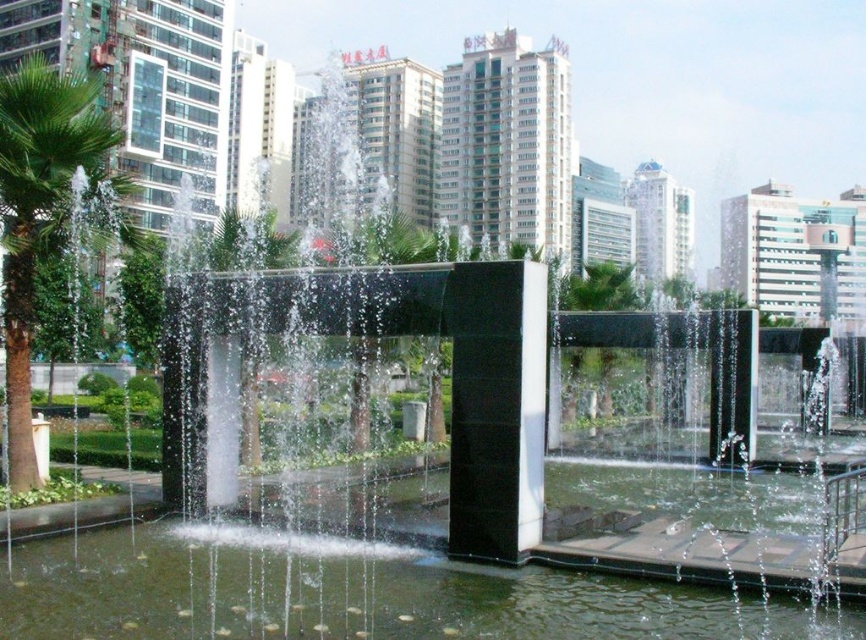
Who is lower down, clear water at center or green leafy palm tree at left?

Positioned lower is clear water at center.

I want to click on clear water at center, so click(354, 593).